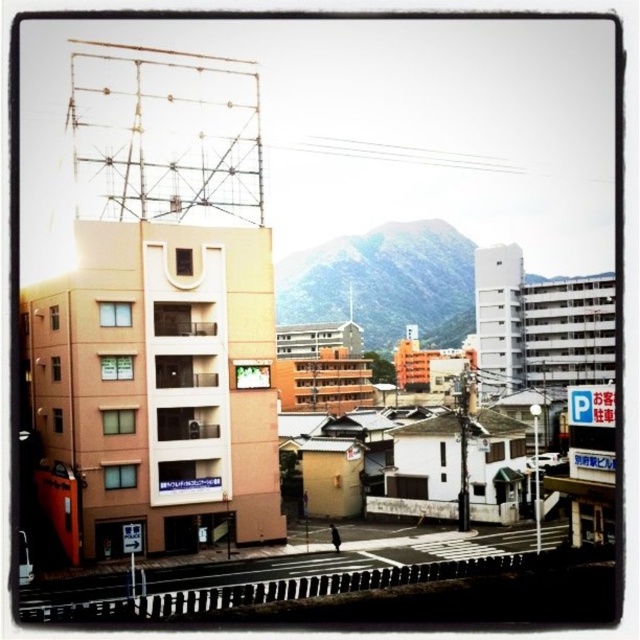
Question: Is green matte mountain at center bigger than black asphalt train track at lower left?

Choices:
 (A) no
 (B) yes

Answer: (B)

Question: Can you confirm if green matte mountain at center is wider than black asphalt train track at lower left?

Choices:
 (A) yes
 (B) no

Answer: (A)

Question: Can you confirm if green matte mountain at center is positioned above black asphalt train track at lower left?

Choices:
 (A) no
 (B) yes

Answer: (B)

Question: Which object appears closest to the camera in this image?

Choices:
 (A) green matte mountain at center
 (B) black asphalt train track at lower left

Answer: (B)

Question: Among these points, which one is farthest from the camera?

Choices:
 (A) (372, 564)
 (B) (380, 252)

Answer: (B)